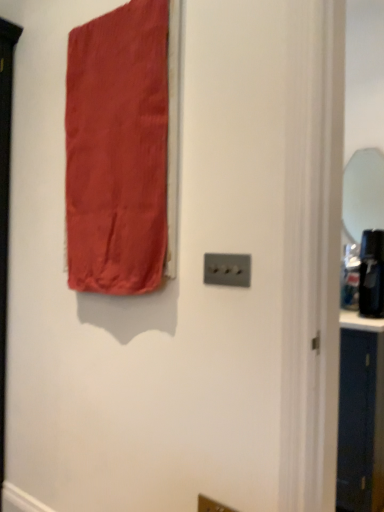
Question: Can you confirm if clear glass mirror at right is wider than satin red curtain at upper left?

Choices:
 (A) no
 (B) yes

Answer: (A)

Question: Is the depth of clear glass mirror at right less than that of satin red curtain at upper left?

Choices:
 (A) yes
 (B) no

Answer: (B)

Question: From the image's perspective, would you say clear glass mirror at right is positioned over satin red curtain at upper left?

Choices:
 (A) yes
 (B) no

Answer: (A)

Question: From a real-world perspective, does clear glass mirror at right sit lower than satin red curtain at upper left?

Choices:
 (A) no
 (B) yes

Answer: (A)

Question: From the image's perspective, is clear glass mirror at right located beneath satin red curtain at upper left?

Choices:
 (A) no
 (B) yes

Answer: (A)

Question: Is clear glass mirror at right oriented towards satin red curtain at upper left?

Choices:
 (A) yes
 (B) no

Answer: (A)

Question: Considering the relative sizes of satin silver light switch at center and satin red curtain at upper left in the image provided, is satin silver light switch at center thinner than satin red curtain at upper left?

Choices:
 (A) no
 (B) yes

Answer: (B)

Question: From a real-world perspective, is satin silver light switch at center beneath satin red curtain at upper left?

Choices:
 (A) no
 (B) yes

Answer: (B)

Question: Is satin silver light switch at center further to the viewer compared to satin red curtain at upper left?

Choices:
 (A) yes
 (B) no

Answer: (B)

Question: Is satin red curtain at upper left located within satin silver light switch at center?

Choices:
 (A) yes
 (B) no

Answer: (B)

Question: Does satin silver light switch at center have a lesser height compared to satin red curtain at upper left?

Choices:
 (A) yes
 (B) no

Answer: (A)

Question: Is satin silver light switch at center to the left of satin red curtain at upper left from the viewer's perspective?

Choices:
 (A) yes
 (B) no

Answer: (B)

Question: Is satin red curtain at upper left shorter than satin silver light switch at center?

Choices:
 (A) no
 (B) yes

Answer: (A)